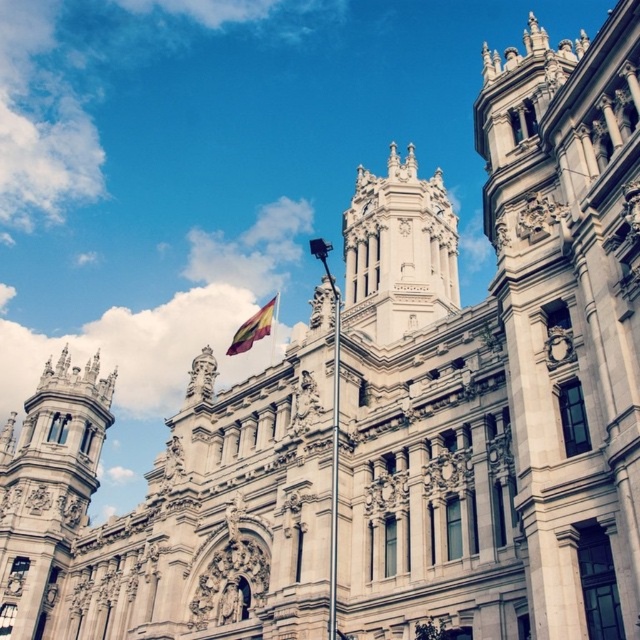
Between metallic flag pole at center and polyester flag at center, which one has less height?

Standing shorter between the two is polyester flag at center.

Is metallic flag pole at center to the left of polyester flag at center from the viewer's perspective?

No, metallic flag pole at center is not to the left of polyester flag at center.

Between point (337, 371) and point (266, 323), which one is positioned behind?

Positioned behind is point (266, 323).

The height and width of the screenshot is (640, 640). I want to click on metallic flag pole at center, so click(333, 467).

What do you see at coordinates (48, 488) in the screenshot?
I see `white stone tower at left` at bounding box center [48, 488].

Between white stone tower at left and polyester flag at center, which one appears on the right side from the viewer's perspective?

polyester flag at center is more to the right.

Which is in front, point (61, 547) or point (232, 353)?

Point (232, 353) is in front.

Locate an element on the screen. white stone tower at left is located at coordinates (48, 488).

Can you confirm if white stone tower at center is positioned below polyester flag at center?

No.

Who is shorter, white stone tower at center or polyester flag at center?

polyester flag at center

The height and width of the screenshot is (640, 640). What do you see at coordinates (397, 250) in the screenshot? I see `white stone tower at center` at bounding box center [397, 250].

Image resolution: width=640 pixels, height=640 pixels. What are the coordinates of `white stone tower at center` in the screenshot? It's located at (397, 250).